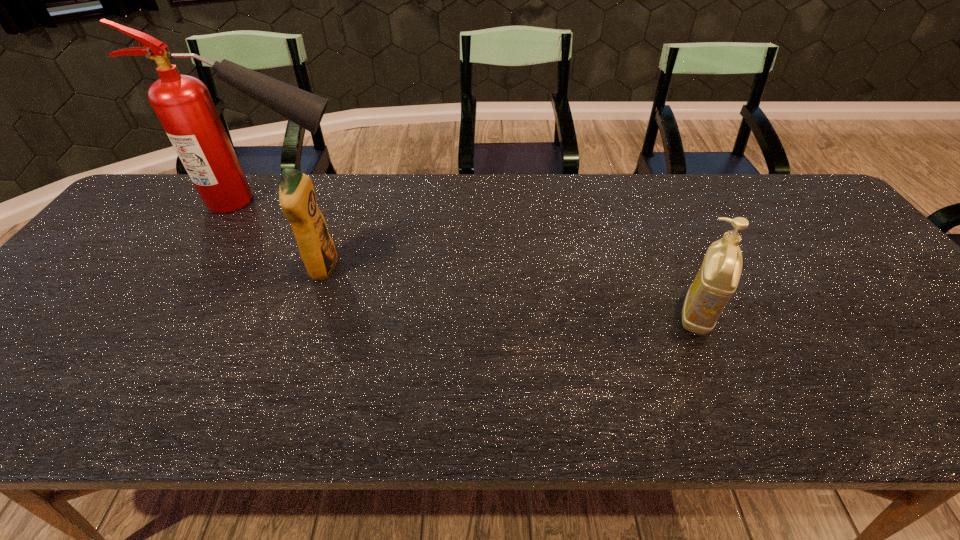
Where is `the farthest object`? the farthest object is located at coordinates (182, 103).

You are a GUI agent. You are given a task and a screenshot of the screen. Output one action in this format:
    pyautogui.click(x=<x>, y=<y>)
    Task: Click on the tallest object
    This screenshot has height=540, width=960.
    Given the screenshot: What is the action you would take?
    pyautogui.click(x=182, y=103)

You are a GUI agent. You are given a task and a screenshot of the screen. Output one action in this format:
    pyautogui.click(x=<x>, y=<y>)
    Task: Click on the second nearest object
    This screenshot has width=960, height=540.
    Given the screenshot: What is the action you would take?
    pyautogui.click(x=297, y=198)

I want to click on the farther detergent, so click(x=297, y=198).

This screenshot has height=540, width=960. Identify the location of the nearer detergent. (717, 279).

Locate an element on the screen. The height and width of the screenshot is (540, 960). the shorter detergent is located at coordinates (717, 279).

The height and width of the screenshot is (540, 960). I want to click on free space located at the nozzle of the farthest object, so click(x=450, y=201).

The width and height of the screenshot is (960, 540). Find the location of `vacant space situated 0.350m on the label of the left detergent`. vacant space situated 0.350m on the label of the left detergent is located at coordinates (472, 268).

This screenshot has width=960, height=540. Find the location of `vacant space located 0.100m on the right of the shorter detergent`. vacant space located 0.100m on the right of the shorter detergent is located at coordinates (763, 315).

Locate an element on the screen. Image resolution: width=960 pixels, height=540 pixels. object that is at the far edge is located at coordinates (182, 103).